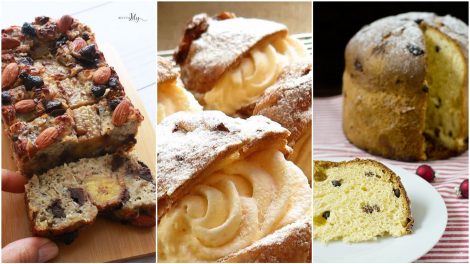
Find the location of a particular element. This screenshot has width=470, height=264. red and white striped tablecloth is located at coordinates (461, 233).